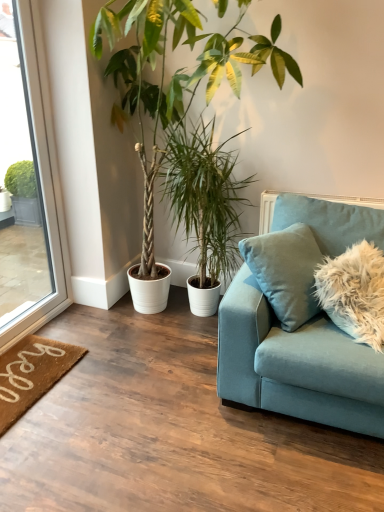
Question: From a real-world perspective, is green leafy plant at upper left, the first houseplant when ordered from left to right, over fluffy light brown pillow at right?

Choices:
 (A) no
 (B) yes

Answer: (B)

Question: From a real-world perspective, is green leafy plant at upper left, positioned as the second houseplant in right-to-left order, beneath fluffy light brown pillow at right?

Choices:
 (A) yes
 (B) no

Answer: (B)

Question: Is green leafy plant at upper left, positioned as the second houseplant in right-to-left order, facing towards fluffy light brown pillow at right?

Choices:
 (A) yes
 (B) no

Answer: (B)

Question: Is fluffy light brown pillow at right at the back of green leafy plant at upper left, the first houseplant when ordered from left to right?

Choices:
 (A) no
 (B) yes

Answer: (A)

Question: Is green leafy plant at upper left, positioned as the second houseplant in right-to-left order, smaller than fluffy light brown pillow at right?

Choices:
 (A) no
 (B) yes

Answer: (A)

Question: From the image's perspective, is green leafy plant at upper left, positioned as the second houseplant in right-to-left order, below fluffy light brown pillow at right?

Choices:
 (A) yes
 (B) no

Answer: (B)

Question: From the image's perspective, is fluffy light brown pillow at right over green leafy plant at center, the first houseplant positioned from the right?

Choices:
 (A) yes
 (B) no

Answer: (B)

Question: Is fluffy light brown pillow at right bigger than green leafy plant at center, placed as the 2th houseplant when sorted from left to right?

Choices:
 (A) no
 (B) yes

Answer: (A)

Question: From a real-world perspective, is fluffy light brown pillow at right located higher than green leafy plant at center, placed as the 2th houseplant when sorted from left to right?

Choices:
 (A) yes
 (B) no

Answer: (B)

Question: Is fluffy light brown pillow at right touching green leafy plant at center, placed as the 2th houseplant when sorted from left to right?

Choices:
 (A) no
 (B) yes

Answer: (A)

Question: Is fluffy light brown pillow at right positioned beyond the bounds of green leafy plant at center, placed as the 2th houseplant when sorted from left to right?

Choices:
 (A) no
 (B) yes

Answer: (B)

Question: Can you confirm if fluffy light brown pillow at right is taller than green leafy plant at center, the first houseplant positioned from the right?

Choices:
 (A) yes
 (B) no

Answer: (B)

Question: Can you confirm if clear glass window at left is bigger than green leafy plant at center, placed as the 2th houseplant when sorted from left to right?

Choices:
 (A) yes
 (B) no

Answer: (B)